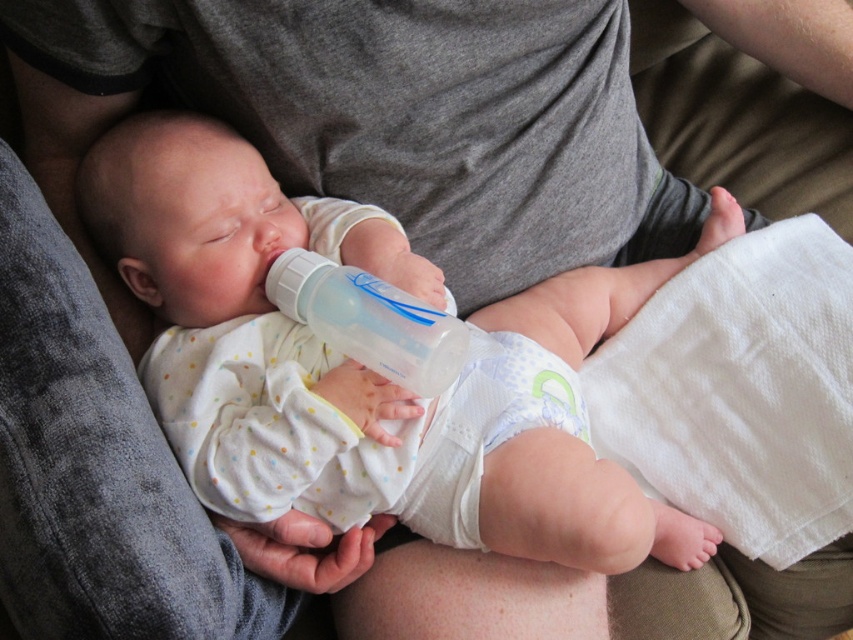
Question: Among these points, which one is nearest to the camera?

Choices:
 (A) (447, 438)
 (B) (350, 330)
 (C) (189, 256)

Answer: (B)

Question: Does white soft baby bottle at center appear on the left side of white soft diaper at center?

Choices:
 (A) yes
 (B) no

Answer: (A)

Question: Which of the following is the closest to the observer?

Choices:
 (A) white soft diaper at center
 (B) transparent plastic baby bottle at center

Answer: (B)

Question: Which point is farther to the camera?

Choices:
 (A) transparent plastic baby bottle at center
 (B) white soft diaper at center
 (C) white soft baby bottle at center

Answer: (B)

Question: Is white soft baby bottle at center in front of white soft diaper at center?

Choices:
 (A) yes
 (B) no

Answer: (A)

Question: Is white soft baby bottle at center below white soft diaper at center?

Choices:
 (A) yes
 (B) no

Answer: (B)